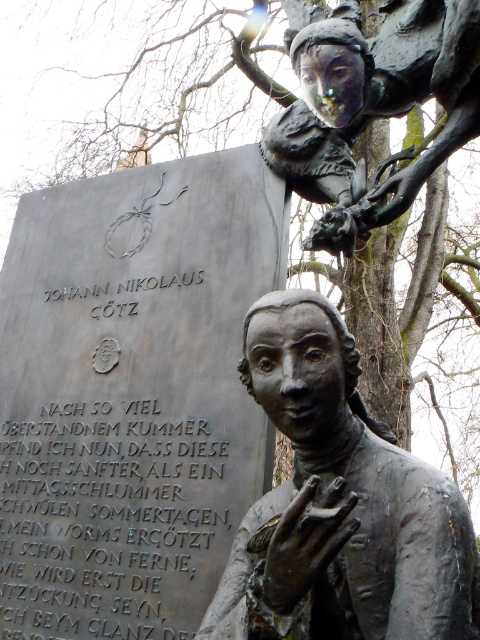
You are an art student analyzing the composition of the sculpture in the image. Based on the placement of the bronze statue at center and the bronze statue at upper right, which one appears to be in a higher position?

The bronze statue at upper right is positioned higher than the bronze statue at center.

You are an art student analyzing the sculpture composition. Based on the scene, which bronze statue is taller between the bronze statue at center and the bronze statue at upper right?

The bronze statue at center is taller than the bronze statue at upper right according to the description.